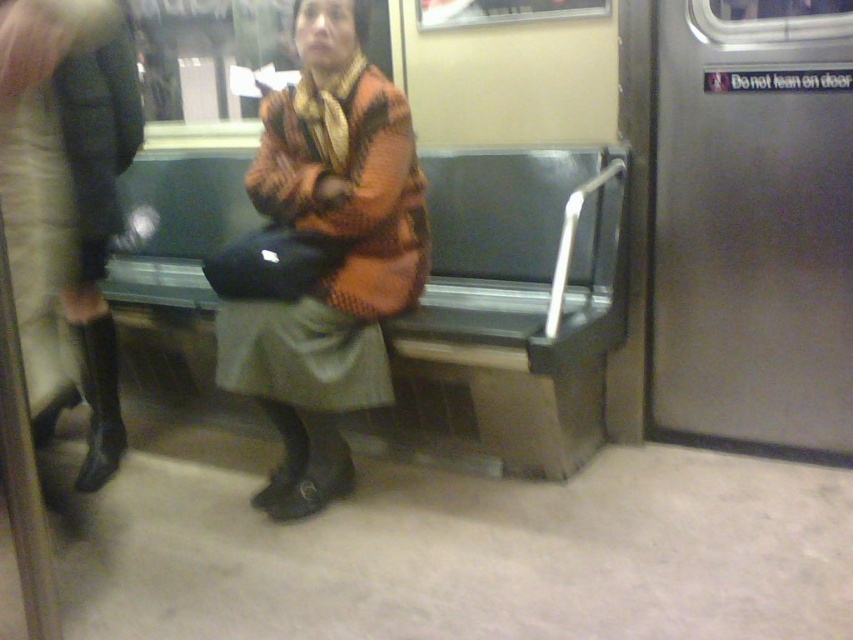
Question: Which point is farther to the camera?

Choices:
 (A) (325, 413)
 (B) (140, 125)

Answer: (B)

Question: Which point is closer to the camera?

Choices:
 (A) orange knitted sweater at center
 (B) velvet black boots at left

Answer: (B)

Question: Does green fabric bench at center appear under velvet black boots at left?

Choices:
 (A) yes
 (B) no

Answer: (A)

Question: Does orange knitted sweater at center have a greater width compared to velvet black boots at left?

Choices:
 (A) no
 (B) yes

Answer: (B)

Question: Which object is positioned farthest from the velvet black boots at left?

Choices:
 (A) green fabric bench at center
 (B) orange knitted sweater at center

Answer: (A)

Question: Does green fabric bench at center appear on the right side of velvet black boots at left?

Choices:
 (A) yes
 (B) no

Answer: (A)